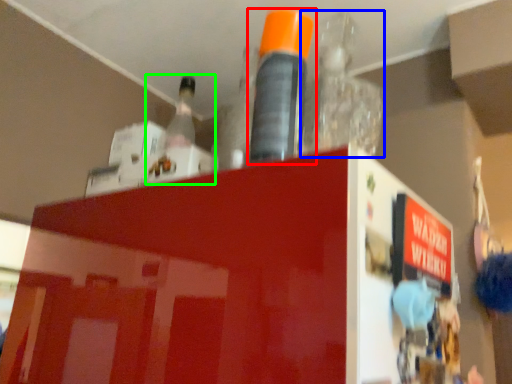
Question: Estimate the real-world distances between objects in this image. Which object is farther from bottle (highlighted by a red box), bottle (highlighted by a blue box) or bottle (highlighted by a green box)?

Choices:
 (A) bottle
 (B) bottle

Answer: (B)